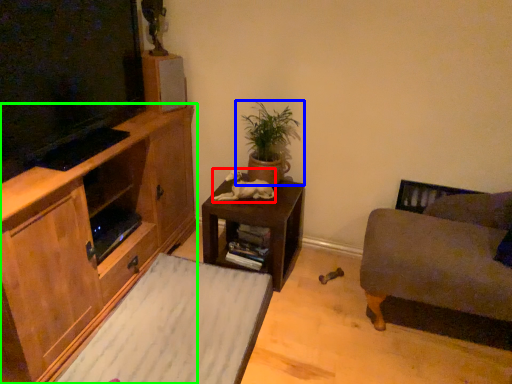
Question: Based on their relative distances, which object is farther from animal (highlighted by a red box)? Choose from houseplant (highlighted by a blue box) and cabinetry (highlighted by a green box).

Choices:
 (A) houseplant
 (B) cabinetry

Answer: (B)